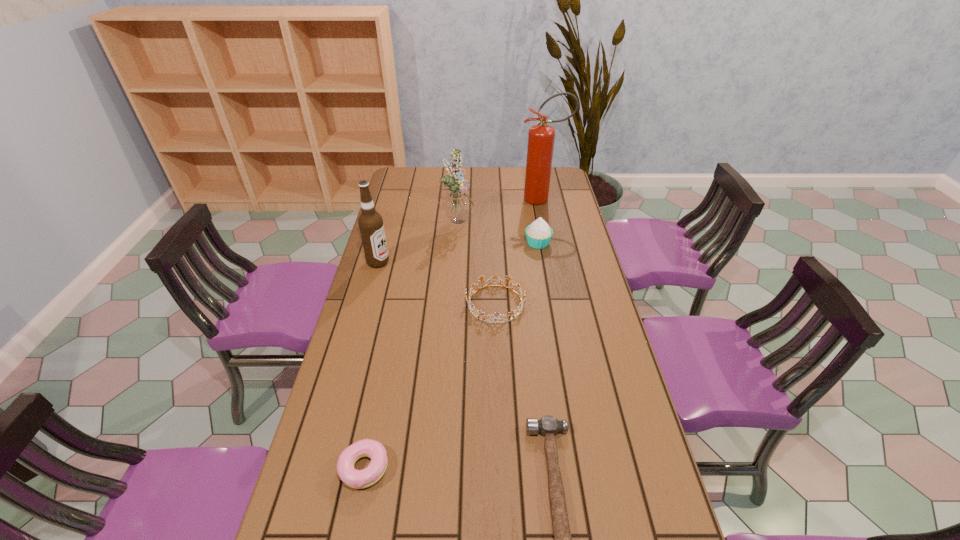
Identify the location of the tallest object. (541, 137).

At what (x,y) coordinates should I click in order to perform the action: click on fire extinguisher. Please return your answer as a coordinate pair (x, y). The height and width of the screenshot is (540, 960). Looking at the image, I should click on (541, 137).

Where is `alcohol`? The image size is (960, 540). alcohol is located at coordinates (370, 222).

Where is `the fourth farthest object`? The image size is (960, 540). the fourth farthest object is located at coordinates (370, 222).

What are the coordinates of `the second farthest object` in the screenshot? It's located at (458, 205).

This screenshot has height=540, width=960. Find the location of `cupcake`. cupcake is located at coordinates (538, 234).

Where is `the fifth nearest object`? This screenshot has width=960, height=540. the fifth nearest object is located at coordinates (538, 234).

Identify the location of the third shortest object. (469, 302).

Locate an element on the screen. The width and height of the screenshot is (960, 540). the fifth farthest object is located at coordinates (469, 302).

This screenshot has height=540, width=960. In order to click on doughnut in this screenshot , I will do [358, 479].